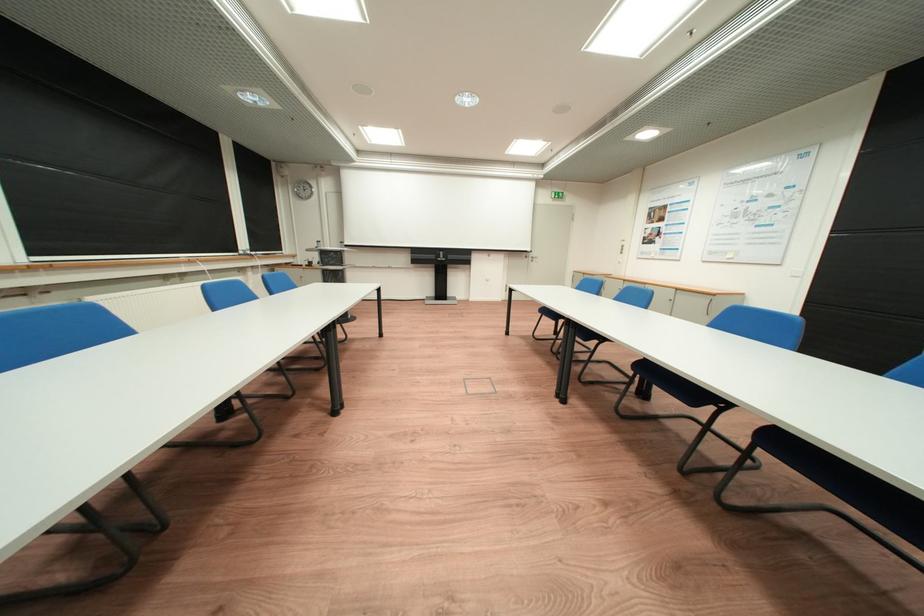
The width and height of the screenshot is (924, 616). In order to click on cabinet handle in this screenshot , I will do `click(710, 309)`.